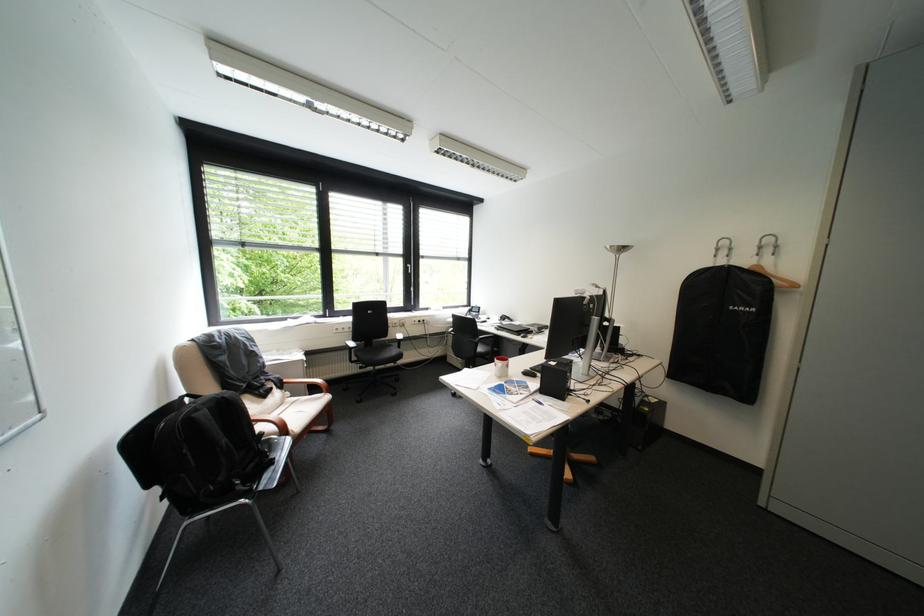
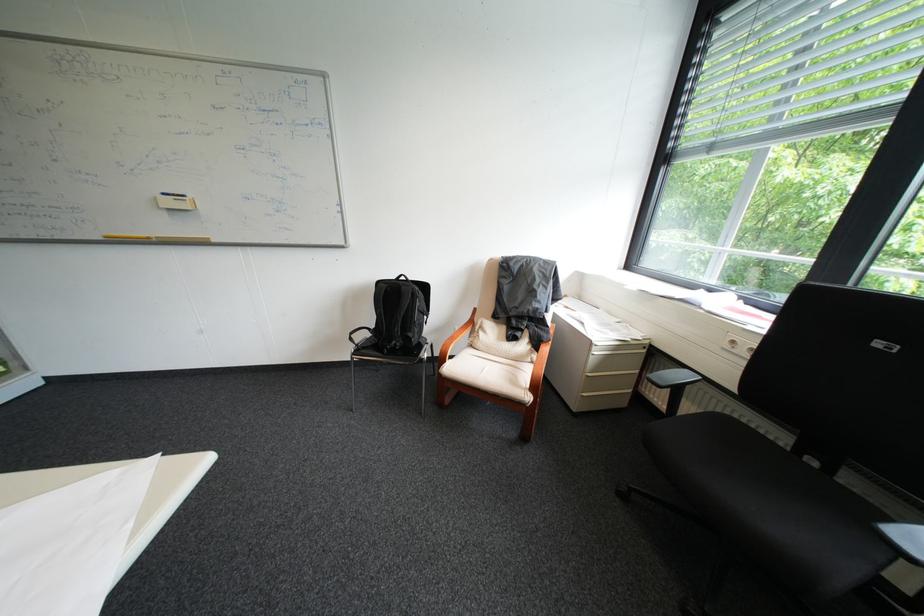
In the second image, find the point that corresponds to point (348, 330) in the first image.

(746, 342)